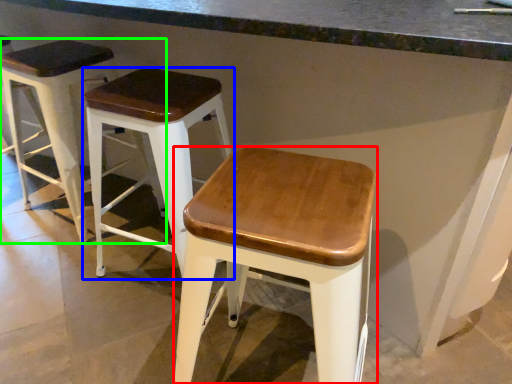
Question: Considering the real-world distances, which object is farthest from stool (highlighted by a red box)? stool (highlighted by a blue box) or stool (highlighted by a green box)?

Choices:
 (A) stool
 (B) stool

Answer: (B)